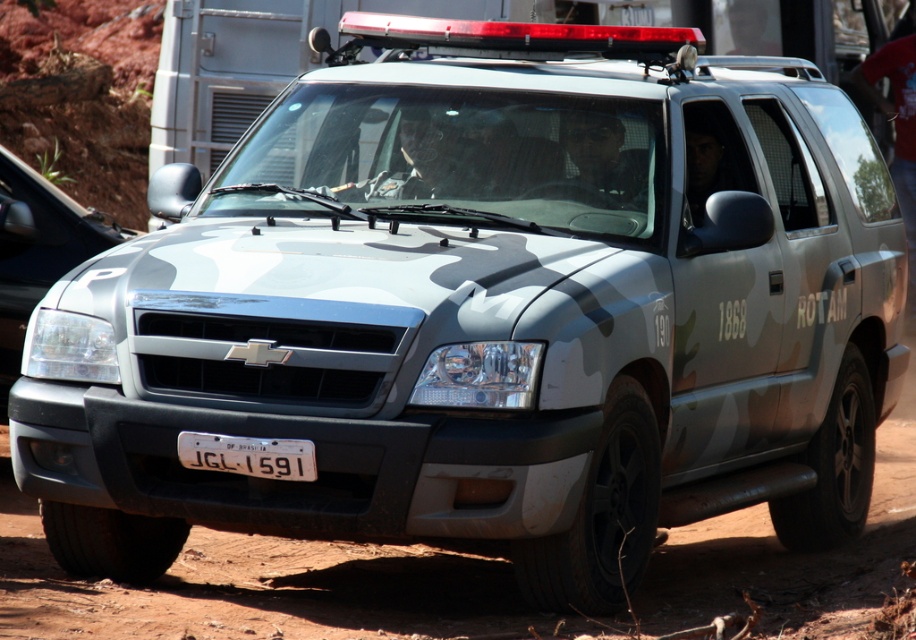
What do you see at coordinates (37, 252) in the screenshot?
I see `matte gray headlight at center` at bounding box center [37, 252].

This screenshot has width=916, height=640. I want to click on matte gray headlight at center, so click(x=37, y=252).